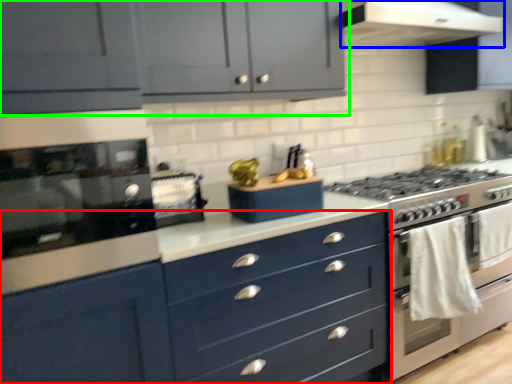
Question: Estimate the real-world distances between objects in this image. Which object is closer to chest of drawers (highlighted by a red box), home appliance (highlighted by a blue box) or cabinetry (highlighted by a green box)?

Choices:
 (A) home appliance
 (B) cabinetry

Answer: (B)